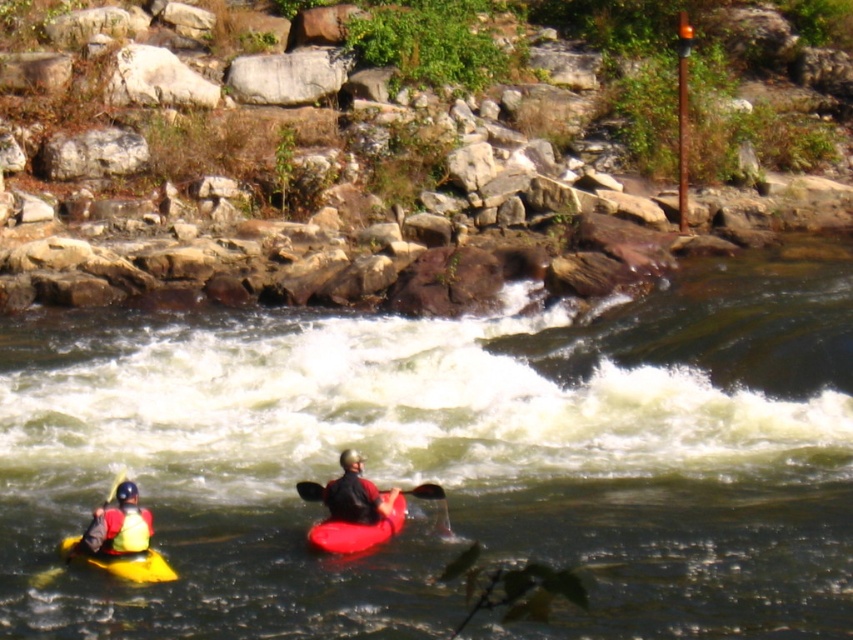
From the picture: Does rough textured rocks at upper center have a lesser width compared to yellow matte kayak at lower left?

In fact, rough textured rocks at upper center might be wider than yellow matte kayak at lower left.

Is point (639, 164) closer to camera compared to point (122, 570)?

No, it is not.

Find the location of a particular element. The height and width of the screenshot is (640, 853). rough textured rocks at upper center is located at coordinates (413, 166).

Does point (335, 496) come in front of point (67, 538)?

No, it is not.

Can you confirm if matte black kayak at center is wider than yellow matte kayak at lower left?

Incorrect, matte black kayak at center's width does not surpass yellow matte kayak at lower left's.

Who is more distant from viewer, (360,458) or (68,538)?

Point (360,458)

This screenshot has width=853, height=640. Identify the location of matte black kayak at center. (355, 493).

Is point (577, 452) positioned in front of point (154, 566)?

No, (577, 452) is further to viewer.

Does green rubber kayak at center have a greater height compared to yellow matte kayak at lower left?

Correct, green rubber kayak at center is much taller as yellow matte kayak at lower left.

Between point (339, 346) and point (142, 564), which one is positioned behind?

The point (339, 346) is behind.

Where is `green rubber kayak at center`? green rubber kayak at center is located at coordinates (451, 458).